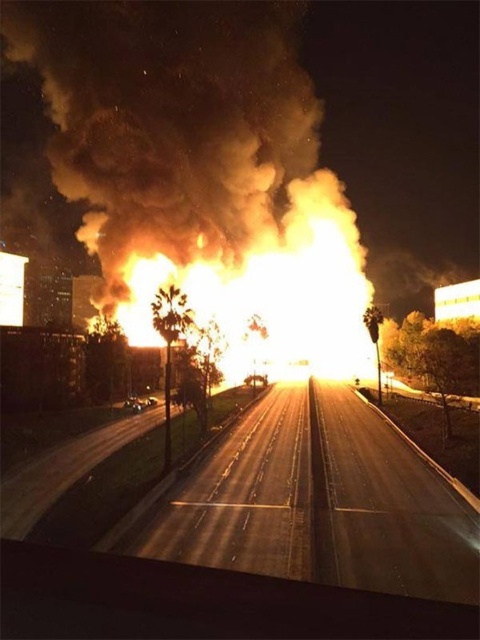
Question: Which of the following is the farthest from the observer?

Choices:
 (A) fluorescent orange smoke at center
 (B) smooth asphalt highway at center

Answer: (A)

Question: Which point is farther from the camera taking this photo?

Choices:
 (A) (311, 426)
 (B) (263, 38)

Answer: (B)

Question: Which point is closer to the camera?

Choices:
 (A) smooth asphalt highway at center
 (B) fluorescent orange smoke at center

Answer: (A)

Question: Is fluorescent orange smoke at center positioned at the back of smooth asphalt highway at center?

Choices:
 (A) no
 (B) yes

Answer: (B)

Question: Is fluorescent orange smoke at center thinner than smooth asphalt highway at center?

Choices:
 (A) no
 (B) yes

Answer: (A)

Question: Is fluorescent orange smoke at center bigger than smooth asphalt highway at center?

Choices:
 (A) yes
 (B) no

Answer: (A)